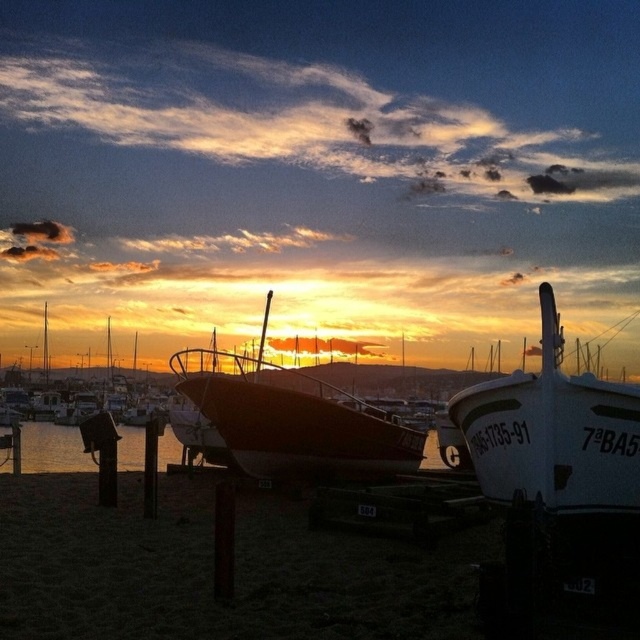
You are standing at the camera position and want to take a photo of the white glossy boat at center. Can you reach the boat within 10 meters without moving the camera?

The white glossy boat at center and camera are 7.52 meters apart from each other, so yes, you can reach the boat within 10 meters without moving the camera.

You are a photographer standing at the edge of the dock. You want to take a photo of both the white glossy boat at center and the shiny red boat at center. Which boat will appear closer to the camera in the photo?

The white glossy boat at center will appear closer to the camera because it is positioned in front of the shiny red boat at center.

You are a photographer planning to capture both the white glossy boat at center and the shiny red boat at center in your shot. Based on their sizes, which boat should you focus on first to ensure it fits entirely within the frame?

The white glossy boat at center is shorter than the shiny red boat at center, so you should focus on capturing the shiny red boat at center first since it is larger and requires more space in the frame.